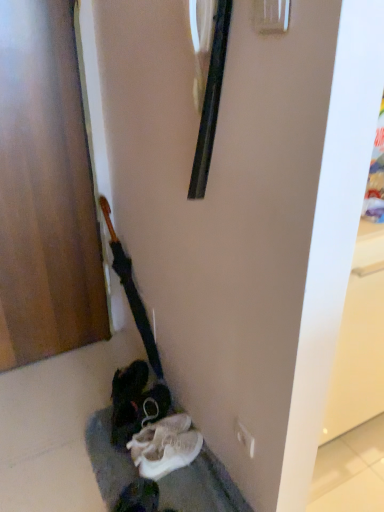
Based on the photo, measure the distance between point (x=190, y=453) and camera.

1.47 meters.

This screenshot has width=384, height=512. I want to click on white fabric shoe at lower center, so click(165, 446).

Is wooden door at left situated inside white fabric shoe at lower center or outside?

The correct answer is: outside.

Which object is further away from the camera, wooden door at left or white fabric shoe at lower center?

white fabric shoe at lower center is further away from the camera.

Which of these two, wooden door at left or white fabric shoe at lower center, is wider?

Wider between the two is white fabric shoe at lower center.

Is wooden door at left smaller than white fabric shoe at lower center?

Incorrect, wooden door at left is not smaller in size than white fabric shoe at lower center.

This screenshot has height=512, width=384. I want to click on door lying above the wooden polished guitar at left (from the image's perspective), so click(45, 191).

Is wooden door at left wider than wooden polished guitar at left?

Incorrect, the width of wooden door at left does not surpass that of wooden polished guitar at left.

From the image's perspective, which is above, wooden door at left or wooden polished guitar at left?

wooden door at left.

Could you tell me if wooden door at left is facing wooden polished guitar at left?

No.

How many degrees apart are the facing directions of white fabric shoe at lower center and wooden polished guitar at left?

They differ by 0.000535 degrees in their facing directions.

In terms of width, does white fabric shoe at lower center look wider or thinner when compared to wooden polished guitar at left?

white fabric shoe at lower center is wider than wooden polished guitar at left.

Is point (191, 451) behind point (157, 370)?

No.

Is point (120, 258) positioned in front of point (57, 2)?

That is False.

Considering the sizes of objects wooden polished guitar at left and wooden door at left in the image provided, who is smaller, wooden polished guitar at left or wooden door at left?

Smaller between the two is wooden polished guitar at left.

Looking at their sizes, would you say wooden polished guitar at left is wider or thinner than wooden door at left?

In the image, wooden polished guitar at left appears to be wider than wooden door at left.

From the image's perspective, is wooden polished guitar at left located beneath wooden door at left?

Yes, from the image's perspective, wooden polished guitar at left is beneath wooden door at left.

Is white fabric shoe at lower center surrounded by wooden polished guitar at left?

No, white fabric shoe at lower center is not surrounded by wooden polished guitar at left.

From the picture: Which is more to the right, wooden polished guitar at left or white fabric shoe at lower center?

white fabric shoe at lower center.

Is wooden polished guitar at left oriented towards white fabric shoe at lower center?

No.

Which object is further away from the camera taking this photo, wooden polished guitar at left or white fabric shoe at lower center?

wooden polished guitar at left is further from the camera.

Can you confirm if white fabric shoe at lower center is taller than wooden door at left?

No.

From the image's perspective, which one is positioned higher, white fabric shoe at lower center or wooden door at left?

wooden door at left.

From a real-world perspective, who is located higher, white fabric shoe at lower center or wooden door at left?

From a 3D spatial view, wooden door at left is above.

Which of these two, white fabric shoe at lower center or wooden door at left, is bigger?

Bigger between the two is wooden door at left.

Where is `door on the left of white fabric shoe at lower center`? door on the left of white fabric shoe at lower center is located at coordinates (45, 191).

Identify the location of guitar below the wooden door at left (from the image's perspective). (131, 292).

Which object lies further to the anchor point white fabric shoe at lower center, wooden polished guitar at left or wooden door at left?

wooden door at left lies further to white fabric shoe at lower center than the other object.

Considering their positions, is wooden door at left positioned closer to white fabric shoe at lower center than wooden polished guitar at left?

Based on the image, wooden polished guitar at left appears to be nearer to white fabric shoe at lower center.

Looking at the image, which one is located further to wooden polished guitar at left, wooden door at left or white fabric shoe at lower center?

white fabric shoe at lower center.

Considering their positions, is wooden polished guitar at left positioned further to wooden door at left than white fabric shoe at lower center?

white fabric shoe at lower center.

Looking at the image, which one is located closer to wooden door at left, white fabric shoe at lower center or wooden polished guitar at left?

wooden polished guitar at left lies closer to wooden door at left than the other object.

Looking at the image, which one is located closer to wooden polished guitar at left, white fabric shoe at lower center or wooden door at left?

wooden door at left is closer to wooden polished guitar at left.

Where is `guitar between wooden door at left and white fabric shoe at lower center in the vertical direction`? The height and width of the screenshot is (512, 384). guitar between wooden door at left and white fabric shoe at lower center in the vertical direction is located at coordinates (131, 292).